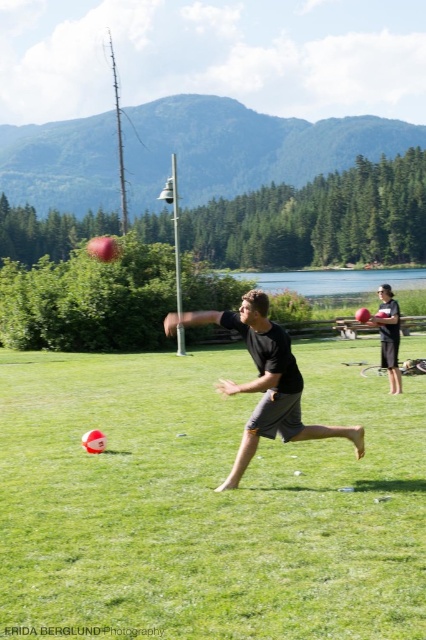
Between green grassy field at center and black matte shirt at center, which one is positioned lower?

green grassy field at center

Who is taller, green grassy field at center or black matte shirt at center?

Standing taller between the two is black matte shirt at center.

Which is behind, point (62, 426) or point (359, 445)?

The point (62, 426) is more distant.

At what (x,y) coordinates should I click in order to perform the action: click on green grassy field at center. Please return your answer as a coordinate pair (x, y). The image size is (426, 640). Looking at the image, I should click on (207, 500).

Is black matte shirt at center above matte black shorts at center?

No, black matte shirt at center is not above matte black shorts at center.

Does point (218, 381) come in front of point (382, 355)?

Yes, point (218, 381) is in front of point (382, 355).

The image size is (426, 640). Describe the element at coordinates (264, 380) in the screenshot. I see `black matte shirt at center` at that location.

Locate an element on the screen. The width and height of the screenshot is (426, 640). black matte shirt at center is located at coordinates coord(264,380).

Is green grassy field at center to the right of matte black shorts at center from the viewer's perspective?

Incorrect, green grassy field at center is not on the right side of matte black shorts at center.

Is point (198, 456) closer to camera compared to point (391, 348)?

Yes, it is.

Is point (336, 625) in front of point (400, 388)?

That is True.

Locate an element on the screen. green grassy field at center is located at coordinates (207, 500).